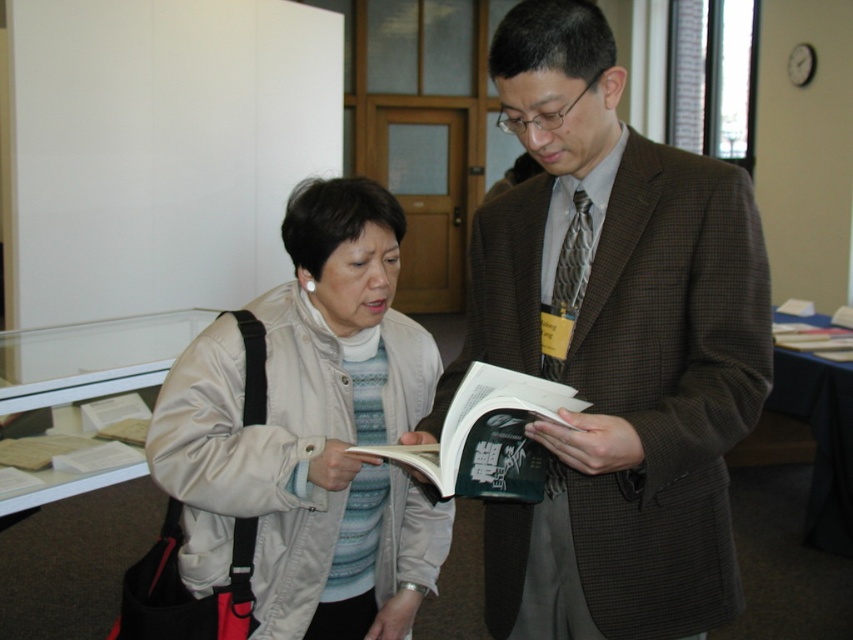
Question: Where is beige satin jacket at center located in relation to green matte book at center in the image?

Choices:
 (A) right
 (B) left

Answer: (B)

Question: Estimate the real-world distances between objects in this image. Which object is closer to the beige satin jacket at center?

Choices:
 (A) brown checkered suit at center
 (B) green matte book at center

Answer: (B)

Question: Which is nearer to the green matte book at center?

Choices:
 (A) brown checkered suit at center
 (B) beige satin jacket at center

Answer: (A)

Question: Which object appears farthest from the camera in this image?

Choices:
 (A) brown checkered suit at center
 (B) green matte book at center
 (C) beige satin jacket at center

Answer: (C)

Question: Can you confirm if brown checkered suit at center is bigger than beige satin jacket at center?

Choices:
 (A) no
 (B) yes

Answer: (B)

Question: Is beige satin jacket at center bigger than green matte book at center?

Choices:
 (A) yes
 (B) no

Answer: (A)